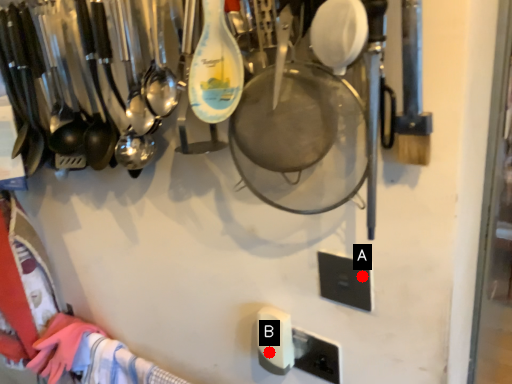
Question: Two points are circled on the image, labeled by A and B beside each circle. Among these points, which one is farthest from the camera?

Choices:
 (A) A is further
 (B) B is further

Answer: (B)